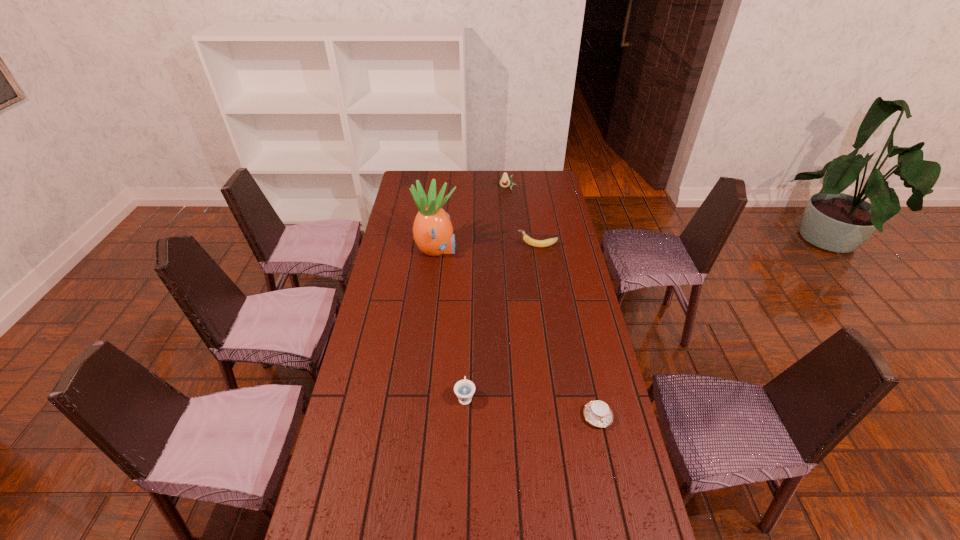
The image size is (960, 540). Find the location of `free region located at the stem of the banana`. free region located at the stem of the banana is located at coordinates (431, 246).

Identify the location of blank area located at the stem of the banana. The height and width of the screenshot is (540, 960). (492, 246).

Locate an element on the screen. free space located at the stem of the banana is located at coordinates click(438, 246).

Find the location of `vacant space situated 0.370m on the side of the second object from left to right with the handle`. vacant space situated 0.370m on the side of the second object from left to right with the handle is located at coordinates (468, 303).

This screenshot has width=960, height=540. I want to click on free space located on the side of the second object from left to right with the handle, so click(468, 310).

Locate an element on the screen. free region located on the side of the second object from left to right with the handle is located at coordinates (468, 305).

Image resolution: width=960 pixels, height=540 pixels. Identify the location of vacant region located 0.190m on the side with the handle of the shorter teacup. (615, 497).

You are a GUI agent. You are given a task and a screenshot of the screen. Output one action in this format:
    pyautogui.click(x=<x>, y=<y>)
    Task: Click on the object that is at the far edge
    Image resolution: width=960 pixels, height=540 pixels.
    Given the screenshot: What is the action you would take?
    pyautogui.click(x=505, y=181)

Where is `object that is at the left edge`? The image size is (960, 540). object that is at the left edge is located at coordinates (432, 229).

Find the location of a particular element. This screenshot has width=960, height=540. banana present at the right edge is located at coordinates (536, 243).